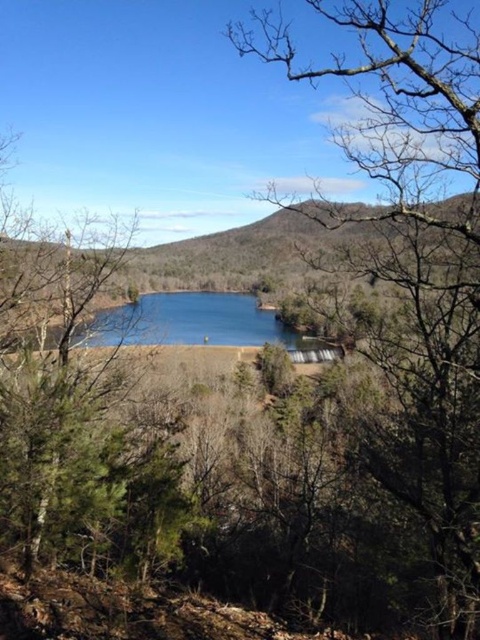
Question: Which of the following is the closest to the observer?

Choices:
 (A) (162, 310)
 (B) (437, 358)

Answer: (B)

Question: Does bare branches at center appear on the right side of blue glass water at center?

Choices:
 (A) yes
 (B) no

Answer: (A)

Question: Where is bare branches at center located in relation to blue glass water at center in the image?

Choices:
 (A) below
 (B) above

Answer: (B)

Question: Does bare branches at center appear on the right side of blue glass water at center?

Choices:
 (A) no
 (B) yes

Answer: (B)